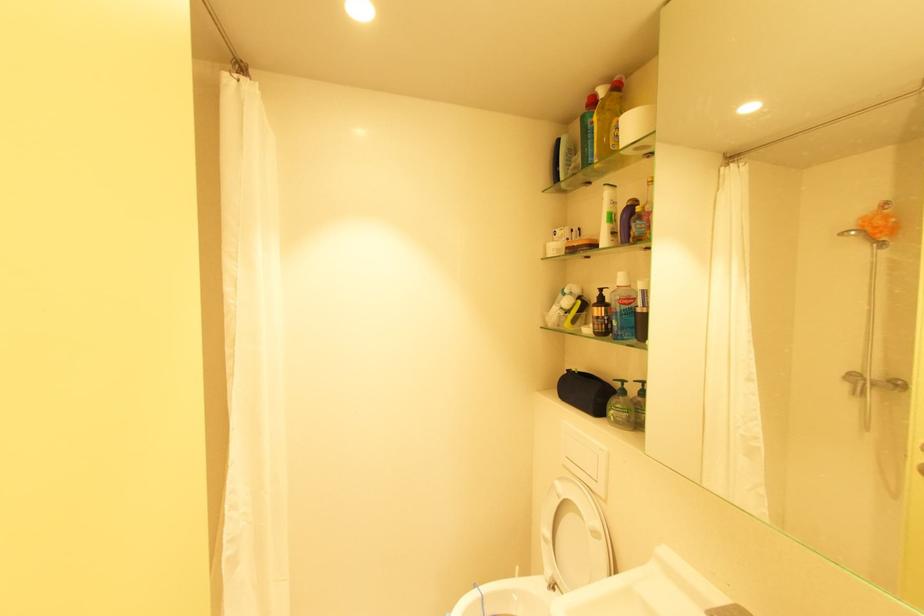
You are a GUI agent. You are given a task and a screenshot of the screen. Output one action in this format:
    pyautogui.click(x=<x>, y=<y>)
    Task: Click on the shower mixer handle
    The image size is (924, 616).
    Given the screenshot: What is the action you would take?
    pyautogui.click(x=871, y=382)